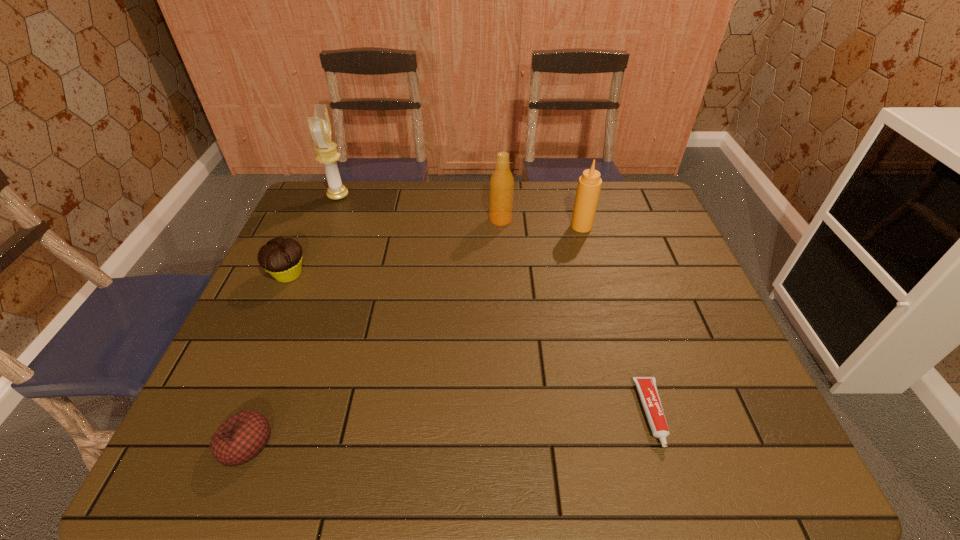
I want to click on vacant space located on the right of the third object from right to left, so click(x=568, y=220).

Where is `free space located 0.180m on the right of the muffin`? free space located 0.180m on the right of the muffin is located at coordinates (372, 275).

Where is `free space located 0.060m on the left of the second shortest object`? The width and height of the screenshot is (960, 540). free space located 0.060m on the left of the second shortest object is located at coordinates (188, 443).

The width and height of the screenshot is (960, 540). Identify the location of award at the far edge. tap(320, 127).

What are the coordinates of `condiment that is at the far edge` in the screenshot? It's located at (589, 185).

The image size is (960, 540). Find the location of `beer bottle at the far edge`. beer bottle at the far edge is located at coordinates (501, 182).

Find the location of a particular element. This screenshot has height=540, width=960. beanbag that is at the near edge is located at coordinates 241,437.

You are a GUI agent. You are given a task and a screenshot of the screen. Output one action in this format:
    pyautogui.click(x=<x>, y=<y>)
    Task: Click on the toothpaste located at the near edge
    
    Given the screenshot: What is the action you would take?
    pyautogui.click(x=647, y=389)

Find the location of a particular element. This screenshot has height=540, width=960. award that is at the left edge is located at coordinates (320, 127).

Where is `muffin that is at the left edge`? The height and width of the screenshot is (540, 960). muffin that is at the left edge is located at coordinates (282, 258).